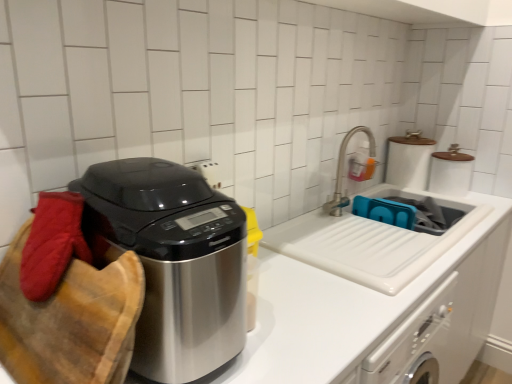
Question: From the image's perspective, is white glossy sink at center on blue plastic sink at center?

Choices:
 (A) no
 (B) yes

Answer: (A)

Question: From a real-world perspective, does white glossy sink at center stand above blue plastic sink at center?

Choices:
 (A) yes
 (B) no

Answer: (B)

Question: Is white glossy sink at center oriented away from blue plastic sink at center?

Choices:
 (A) no
 (B) yes

Answer: (A)

Question: Is white glossy sink at center far away from blue plastic sink at center?

Choices:
 (A) no
 (B) yes

Answer: (A)

Question: Is the surface of white glossy sink at center in direct contact with blue plastic sink at center?

Choices:
 (A) yes
 (B) no

Answer: (B)

Question: From a real-world perspective, is white glossy sink at center positioned above or below blue plastic sink at center?

Choices:
 (A) above
 (B) below

Answer: (B)

Question: Is white glossy sink at center inside or outside of blue plastic sink at center?

Choices:
 (A) inside
 (B) outside

Answer: (B)

Question: Is white glossy sink at center bigger or smaller than blue plastic sink at center?

Choices:
 (A) big
 (B) small

Answer: (A)

Question: Considering the positions of white glossy sink at center and blue plastic sink at center in the image, is white glossy sink at center taller or shorter than blue plastic sink at center?

Choices:
 (A) short
 (B) tall

Answer: (B)

Question: From their relative heights in the image, would you say white glossy sink at center is taller or shorter than polished stainless steel appliance at left?

Choices:
 (A) short
 (B) tall

Answer: (B)

Question: Considering their positions, is white glossy sink at center located in front of or behind polished stainless steel appliance at left?

Choices:
 (A) front
 (B) behind

Answer: (B)

Question: From the image's perspective, is white glossy sink at center positioned above or below polished stainless steel appliance at left?

Choices:
 (A) above
 (B) below

Answer: (B)

Question: Is white glossy sink at center to the left or to the right of polished stainless steel appliance at left in the image?

Choices:
 (A) left
 (B) right

Answer: (B)

Question: Do you think brushed metal faucet at upper right is within blue plastic sink at center, or outside of it?

Choices:
 (A) outside
 (B) inside

Answer: (A)

Question: From a real-world perspective, relative to blue plastic sink at center, is brushed metal faucet at upper right vertically above or below?

Choices:
 (A) above
 (B) below

Answer: (A)